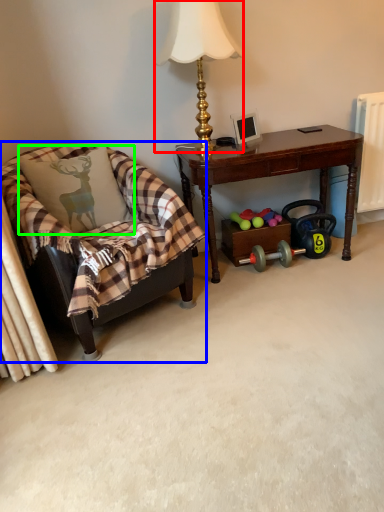
Question: Which object is the farthest from lamp (highlighted by a red box)? Choose among these: chair (highlighted by a blue box) or pillow (highlighted by a green box).

Choices:
 (A) chair
 (B) pillow

Answer: (A)